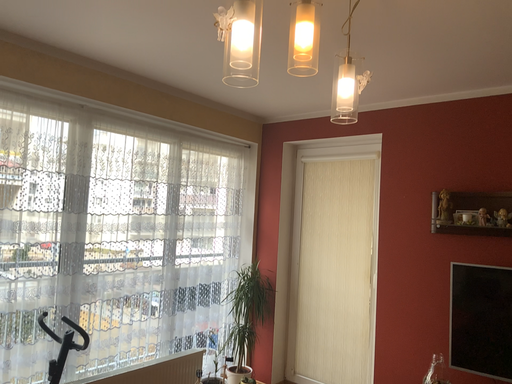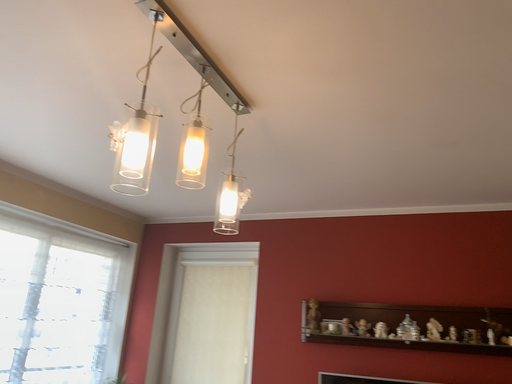
Question: How did the camera likely rotate when shooting the video?

Choices:
 (A) rotated left
 (B) rotated right

Answer: (B)